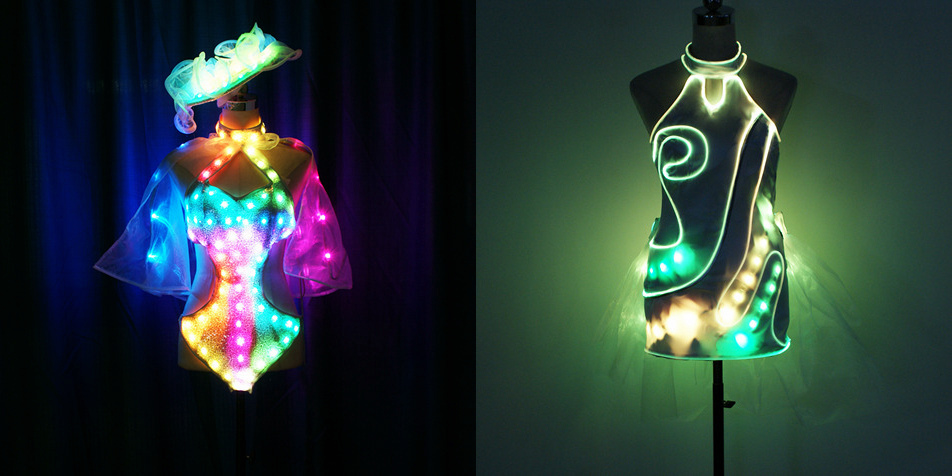
In order to click on sash in this screenshot , I will do `click(210, 80)`.